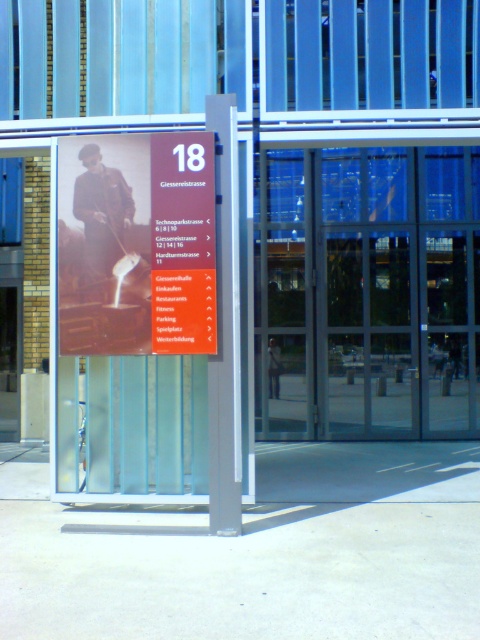
You are standing at the bus stop sign and want to determine the spatial relationship between two points marked on the sign. Which point is closer to you, point 1 at coordinates (197, 180) or point 2 at coordinates (171, 243)?

Point 1 at coordinates (197, 180) is closer to the viewer than point 2 at coordinates (171, 243).

You are standing at the bus stop and want to enter the building through the transparent glass door at center. There is a matte brown poster at center blocking your path. Can you walk around the poster to reach the door?

The transparent glass door at center is further to the viewer than the matte brown poster at center, so the poster is closer to you. You can walk around the poster to reach the door since it is in front of the door.